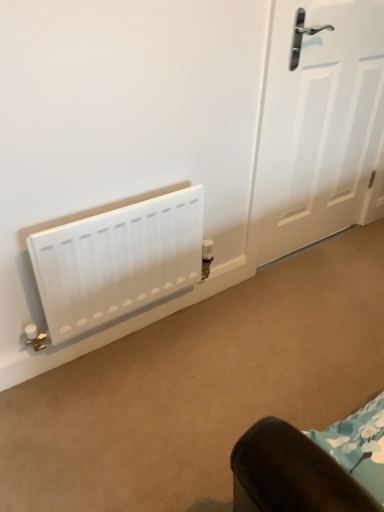
This screenshot has width=384, height=512. Find the location of `white matte radiator at lower left`. white matte radiator at lower left is located at coordinates (117, 261).

What do you see at coordinates (117, 261) in the screenshot? This screenshot has width=384, height=512. I see `white matte radiator at lower left` at bounding box center [117, 261].

Measure the distance between white matte radiator at lower left and camera.

3.43 feet.

Describe the element at coordinates (318, 124) in the screenshot. Image resolution: width=384 pixels, height=512 pixels. I see `white matte door at right` at that location.

I want to click on white matte door at right, so 318,124.

Identify the location of white matte radiator at lower left. The width and height of the screenshot is (384, 512). (117, 261).

Would you say white matte door at right is to the left or to the right of white matte radiator at lower left in the picture?

white matte door at right is positioned on white matte radiator at lower left's right side.

Which object is further away from the camera taking this photo, white matte door at right or white matte radiator at lower left?

white matte door at right is further from the camera.

Considering the positions of points (370, 72) and (136, 266), is point (370, 72) closer to camera compared to point (136, 266)?

No.

From the image's perspective, which object appears higher, white matte door at right or white matte radiator at lower left?

white matte door at right is shown above in the image.

From a real-world perspective, is white matte door at right located higher than white matte radiator at lower left?

Yes, from a real-world perspective, white matte door at right is on top of white matte radiator at lower left.

Which of these two, white matte door at right or white matte radiator at lower left, is wider?

white matte radiator at lower left.

Between white matte door at right and white matte radiator at lower left, which one has more height?

With more height is white matte door at right.

Which of these two, white matte door at right or white matte radiator at lower left, is smaller?

Smaller between the two is white matte radiator at lower left.

Is white matte door at right spatially inside white matte radiator at lower left, or outside of it?

white matte door at right is outside white matte radiator at lower left.

Are white matte door at right and white matte radiator at lower left beside each other?

No, white matte door at right is not making contact with white matte radiator at lower left.

In the scene shown: Is white matte radiator at lower left at the back of white matte door at right?

white matte door at right does not have its back to white matte radiator at lower left.

Can you tell me how much white matte door at right and white matte radiator at lower left differ in facing direction?

white matte door at right and white matte radiator at lower left are facing 0.153 degrees away from each other.

Where is `door behind the white matte radiator at lower left`? The height and width of the screenshot is (512, 384). door behind the white matte radiator at lower left is located at coordinates (318, 124).

Is white matte radiator at lower left at the left side of white matte door at right?

Indeed, white matte radiator at lower left is positioned on the left side of white matte door at right.

Is white matte radiator at lower left behind white matte door at right?

No, white matte radiator at lower left is in front of white matte door at right.

Between point (135, 264) and point (309, 199), which one is positioned in front?

The point (135, 264) is more forward.

From the image's perspective, is white matte radiator at lower left on white matte door at right?

No.

From a real-world perspective, between white matte radiator at lower left and white matte door at right, who is vertically higher?

In real-world perspective, white matte door at right is above.

Considering the sizes of objects white matte radiator at lower left and white matte door at right in the image provided, who is thinner, white matte radiator at lower left or white matte door at right?

Thinner between the two is white matte door at right.

Looking at this image, considering the relative sizes of white matte radiator at lower left and white matte door at right in the image provided, is white matte radiator at lower left taller than white matte door at right?

No, white matte radiator at lower left is not taller than white matte door at right.

Consider the image. Between white matte radiator at lower left and white matte door at right, which one has smaller size?

white matte radiator at lower left.

Is white matte door at right inside white matte radiator at lower left?

No, white matte radiator at lower left does not contain white matte door at right.

Are white matte radiator at lower left and white matte door at right far apart?

They are positioned close to each other.

Is white matte radiator at lower left oriented away from white matte door at right?

white matte radiator at lower left is not turned away from white matte door at right.

How different are the orientations of white matte radiator at lower left and white matte door at right in degrees?

There is a 0.153-degree angle between the facing directions of white matte radiator at lower left and white matte door at right.

You are a GUI agent. You are given a task and a screenshot of the screen. Output one action in this format:
    pyautogui.click(x=<x>, y=<y>)
    Task: Click on the door that appears above the white matte radiator at lower left (from a real-world perspective)
    The width and height of the screenshot is (384, 512).
    Given the screenshot: What is the action you would take?
    pyautogui.click(x=318, y=124)

At what (x,y) coordinates should I click in order to perform the action: click on radiator below the white matte door at right (from a real-world perspective). Please return your answer as a coordinate pair (x, y). This screenshot has height=512, width=384. Looking at the image, I should click on (117, 261).

The width and height of the screenshot is (384, 512). I want to click on radiator located on the left of white matte door at right, so click(x=117, y=261).